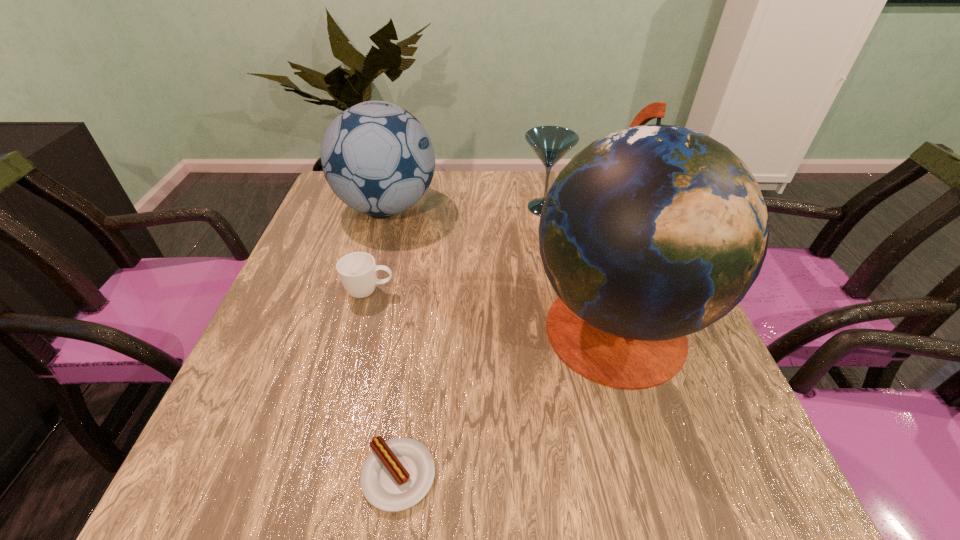
Locate an element on the screen. This screenshot has width=960, height=540. vacant space at the far edge of the desktop is located at coordinates (477, 174).

You are a GUI agent. You are given a task and a screenshot of the screen. Output one action in this format:
    pyautogui.click(x=<x>, y=<y>)
    Task: Click on the vacant space at the near edge of the desktop
    The width and height of the screenshot is (960, 540).
    Given the screenshot: What is the action you would take?
    pos(536,496)

At what (x,y) coordinates should I click in order to perform the action: click on free region at the left edge. Please return your answer as a coordinate pair (x, y). The image size is (960, 540). Looking at the image, I should click on (318, 268).

Find the location of a particular element. free space at the right edge of the desktop is located at coordinates (701, 451).

Where is `vacant area at the near right corner of the desktop`? Image resolution: width=960 pixels, height=540 pixels. vacant area at the near right corner of the desktop is located at coordinates (761, 511).

Locate an element on the screen. This screenshot has height=540, width=960. vacant area between the soccer ball and the sausage is located at coordinates (393, 342).

Where is `vacant space that is in between the tallest object and the cup`? The width and height of the screenshot is (960, 540). vacant space that is in between the tallest object and the cup is located at coordinates (492, 309).

Identify the location of free area in between the nearest object and the tallest object. This screenshot has width=960, height=540. (506, 401).

Where is `free space between the nearest object and the cup`? Image resolution: width=960 pixels, height=540 pixels. free space between the nearest object and the cup is located at coordinates (384, 383).

Image resolution: width=960 pixels, height=540 pixels. In order to click on vacant region between the shortest object and the third tallest object in this screenshot , I will do `click(471, 342)`.